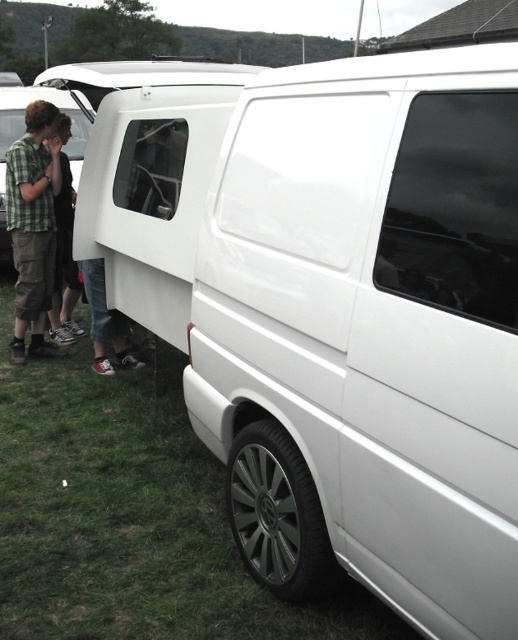
You are standing at the origin point of the coordinate system. You want to move towards the white glossy van at center. What direction should you move in?

Since the white glossy van at center is located at coordinate point (368, 332), you should move towards the positive x and y directions to reach it.

You are standing next to the matte black van at left and want to greet the person wearing the green plaid shirt at left. In which direction should you walk to approach them?

The green plaid shirt at left is positioned on the right side of the matte black van at left. Therefore, you should walk to the right side of the matte black van at left to approach the person wearing the green plaid shirt at left.

You are trying to determine if the green plaid shirt at left can fit into the matte black van at left through its open rear door. Based on their widths, will it fit?

The green plaid shirt at left has a lesser width compared to the matte black van at left, so it should fit through the open rear door.